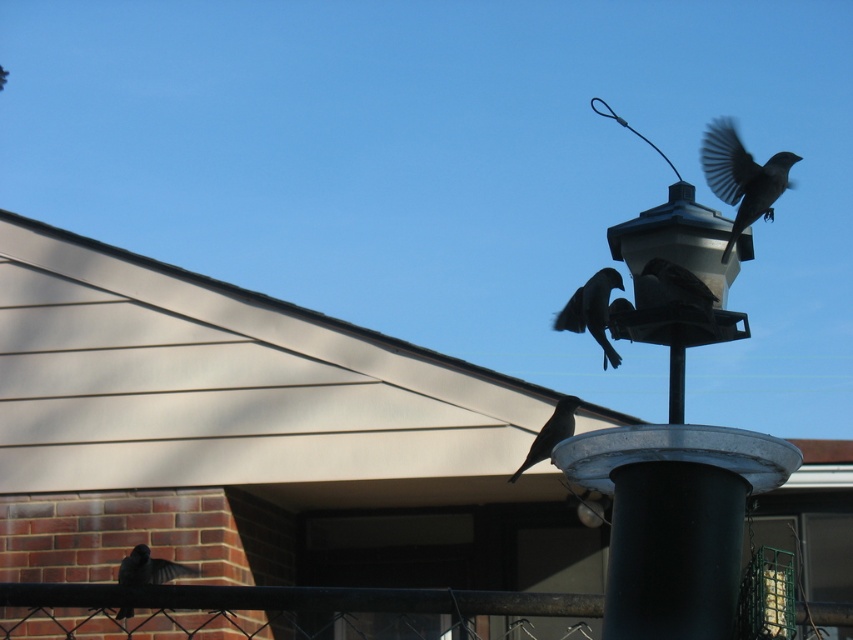
You are standing in the backyard looking at the bird feeder. You notice a shiny black bird at center and dark brown feathers at top right. Which bird is positioned closer to the left side of the feeder?

The shiny black bird at center is positioned to the left of dark brown feathers at top right, so it is closer to the left side of the feeder.